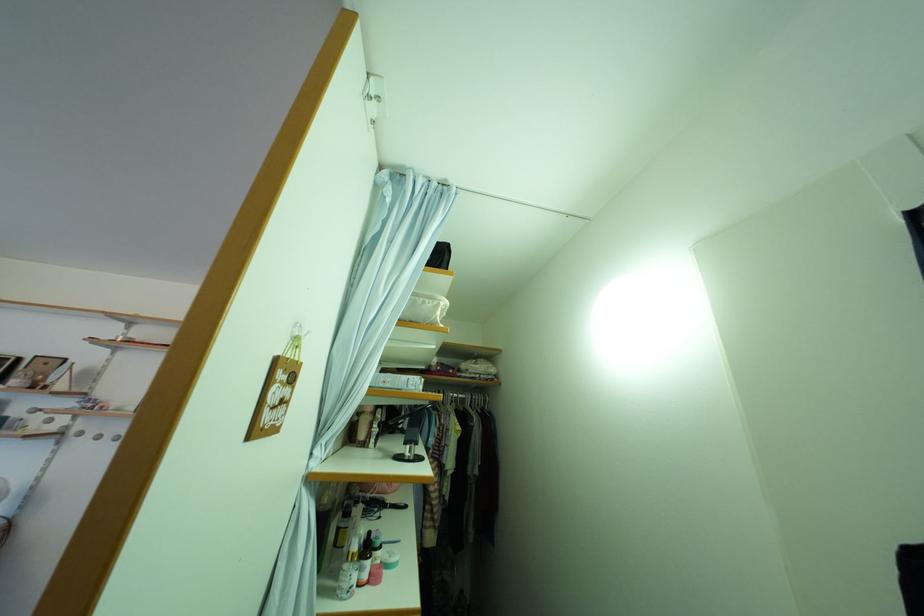
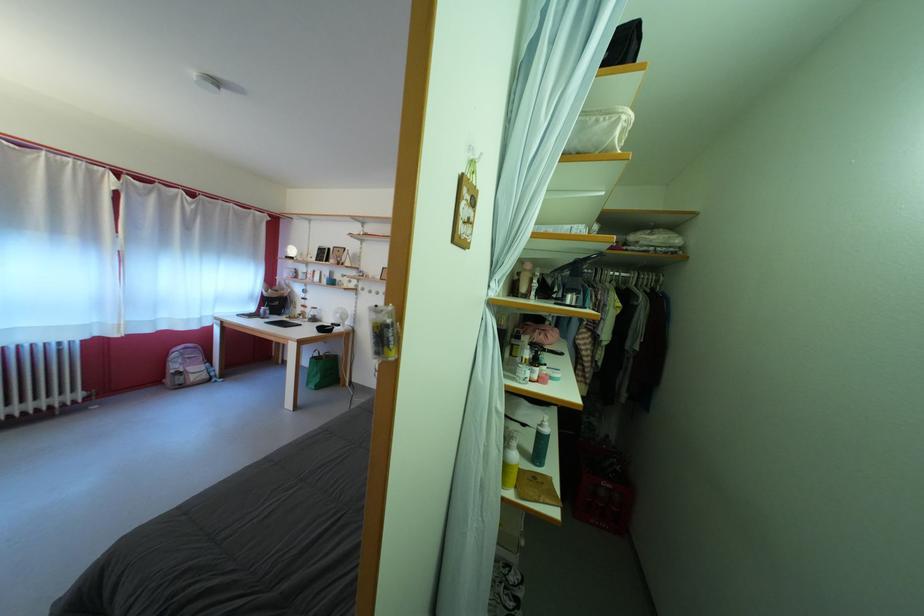
Where in the second image is the point corresponding to point 373,583 from the first image?

(543, 383)